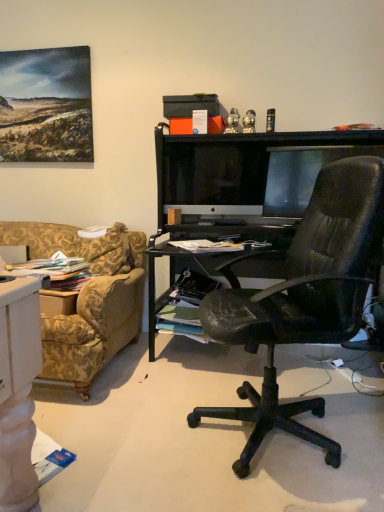
The width and height of the screenshot is (384, 512). Identify the location of matte black monitor at center, which is the 2th computer monitor from left to right. (296, 176).

Image resolution: width=384 pixels, height=512 pixels. Describe the element at coordinates (296, 176) in the screenshot. I see `matte black monitor at center, acting as the 1th computer monitor starting from the right` at that location.

Identify the location of satin black monitor at center, placed as the 1th computer monitor when sorted from left to right. This screenshot has width=384, height=512. (214, 175).

Describe the element at coordinates (214, 175) in the screenshot. The height and width of the screenshot is (512, 384). I see `satin black monitor at center, acting as the 2th computer monitor starting from the right` at that location.

Locate an element on the screen. The height and width of the screenshot is (512, 384). matte black monitor at center, acting as the 1th computer monitor starting from the right is located at coordinates (296, 176).

Is matte black monitor at center, which is the 2th computer monitor from left to right, at the left side of satin black monitor at center, acting as the 2th computer monitor starting from the right?

In fact, matte black monitor at center, which is the 2th computer monitor from left to right, is to the right of satin black monitor at center, acting as the 2th computer monitor starting from the right.

Is matte black monitor at center, which is the 2th computer monitor from left to right, in front of satin black monitor at center, acting as the 2th computer monitor starting from the right?

Yes, the depth of matte black monitor at center, which is the 2th computer monitor from left to right, is less than that of satin black monitor at center, acting as the 2th computer monitor starting from the right.

Considering the positions of points (302, 146) and (188, 192), is point (302, 146) closer to camera compared to point (188, 192)?

Yes, point (302, 146) is closer to viewer.

From the image's perspective, which one is positioned lower, matte black monitor at center, acting as the 1th computer monitor starting from the right, or satin black monitor at center, acting as the 2th computer monitor starting from the right?

matte black monitor at center, acting as the 1th computer monitor starting from the right, from the image's perspective.

From a real-world perspective, which is physically below, matte black monitor at center, which is the 2th computer monitor from left to right, or satin black monitor at center, acting as the 2th computer monitor starting from the right?

matte black monitor at center, which is the 2th computer monitor from left to right.

Which object is wider, matte black monitor at center, acting as the 1th computer monitor starting from the right, or satin black monitor at center, acting as the 2th computer monitor starting from the right?

Wider between the two is satin black monitor at center, acting as the 2th computer monitor starting from the right.

Considering the relative sizes of matte black monitor at center, which is the 2th computer monitor from left to right, and satin black monitor at center, placed as the 1th computer monitor when sorted from left to right, in the image provided, is matte black monitor at center, which is the 2th computer monitor from left to right, shorter than satin black monitor at center, placed as the 1th computer monitor when sorted from left to right,?

Indeed, matte black monitor at center, which is the 2th computer monitor from left to right, has a lesser height compared to satin black monitor at center, placed as the 1th computer monitor when sorted from left to right.

Which of these two, matte black monitor at center, acting as the 1th computer monitor starting from the right, or satin black monitor at center, placed as the 1th computer monitor when sorted from left to right, is bigger?

satin black monitor at center, placed as the 1th computer monitor when sorted from left to right, is bigger.

Is matte black monitor at center, acting as the 1th computer monitor starting from the right, completely or partially outside of satin black monitor at center, acting as the 2th computer monitor starting from the right?

matte black monitor at center, acting as the 1th computer monitor starting from the right, is positioned outside satin black monitor at center, acting as the 2th computer monitor starting from the right.

Consider the image. Is matte black monitor at center, acting as the 1th computer monitor starting from the right, not close to satin black monitor at center, placed as the 1th computer monitor when sorted from left to right?

No, matte black monitor at center, acting as the 1th computer monitor starting from the right, is not far from satin black monitor at center, placed as the 1th computer monitor when sorted from left to right.

Is matte black monitor at center, which is the 2th computer monitor from left to right, turned away from satin black monitor at center, acting as the 2th computer monitor starting from the right?

matte black monitor at center, which is the 2th computer monitor from left to right, does not have its back to satin black monitor at center, acting as the 2th computer monitor starting from the right.

How different are the orientations of matte black monitor at center, which is the 2th computer monitor from left to right, and satin black monitor at center, placed as the 1th computer monitor when sorted from left to right, in degrees?

matte black monitor at center, which is the 2th computer monitor from left to right, and satin black monitor at center, placed as the 1th computer monitor when sorted from left to right, are facing 34.7 degrees away from each other.

Measure the distance between matte black monitor at center, acting as the 1th computer monitor starting from the right, and satin black monitor at center, acting as the 2th computer monitor starting from the right.

10.64 inches.

Locate an element on the screen. computer monitor that is behind the matte black monitor at center, acting as the 1th computer monitor starting from the right is located at coordinates (214, 175).

Considering the relative positions of satin black monitor at center, placed as the 1th computer monitor when sorted from left to right, and matte black monitor at center, which is the 2th computer monitor from left to right, in the image provided, is satin black monitor at center, placed as the 1th computer monitor when sorted from left to right, to the left or to the right of matte black monitor at center, which is the 2th computer monitor from left to right,?

Clearly, satin black monitor at center, placed as the 1th computer monitor when sorted from left to right, is on the left of matte black monitor at center, which is the 2th computer monitor from left to right, in the image.

Is satin black monitor at center, acting as the 2th computer monitor starting from the right, positioned behind matte black monitor at center, which is the 2th computer monitor from left to right?

Yes, it is behind matte black monitor at center, which is the 2th computer monitor from left to right.

Does point (217, 179) come in front of point (297, 169)?

No, (217, 179) is behind (297, 169).

From the image's perspective, is satin black monitor at center, placed as the 1th computer monitor when sorted from left to right, positioned above or below matte black monitor at center, which is the 2th computer monitor from left to right?

satin black monitor at center, placed as the 1th computer monitor when sorted from left to right, is above matte black monitor at center, which is the 2th computer monitor from left to right.

From a real-world perspective, is satin black monitor at center, acting as the 2th computer monitor starting from the right, positioned over matte black monitor at center, which is the 2th computer monitor from left to right, based on gravity?

Yes, from a real-world perspective, satin black monitor at center, acting as the 2th computer monitor starting from the right, is on top of matte black monitor at center, which is the 2th computer monitor from left to right.

Is satin black monitor at center, placed as the 1th computer monitor when sorted from left to right, wider or thinner than matte black monitor at center, which is the 2th computer monitor from left to right?

In the image, satin black monitor at center, placed as the 1th computer monitor when sorted from left to right, appears to be wider than matte black monitor at center, which is the 2th computer monitor from left to right.

In terms of height, does satin black monitor at center, placed as the 1th computer monitor when sorted from left to right, look taller or shorter compared to matte black monitor at center, which is the 2th computer monitor from left to right?

satin black monitor at center, placed as the 1th computer monitor when sorted from left to right, is taller than matte black monitor at center, which is the 2th computer monitor from left to right.

Which of these two, satin black monitor at center, acting as the 2th computer monitor starting from the right, or matte black monitor at center, acting as the 1th computer monitor starting from the right, is bigger?

satin black monitor at center, acting as the 2th computer monitor starting from the right, is bigger.

Is satin black monitor at center, placed as the 1th computer monitor when sorted from left to right, spatially inside matte black monitor at center, which is the 2th computer monitor from left to right, or outside of it?

satin black monitor at center, placed as the 1th computer monitor when sorted from left to right, is not inside matte black monitor at center, which is the 2th computer monitor from left to right, it's outside.

Is satin black monitor at center, placed as the 1th computer monitor when sorted from left to right, next to matte black monitor at center, which is the 2th computer monitor from left to right?

They are not placed beside each other.

Is satin black monitor at center, acting as the 2th computer monitor starting from the right, looking in the opposite direction of matte black monitor at center, which is the 2th computer monitor from left to right?

No.

Can you tell me how much satin black monitor at center, placed as the 1th computer monitor when sorted from left to right, and matte black monitor at center, which is the 2th computer monitor from left to right, differ in facing direction?

satin black monitor at center, placed as the 1th computer monitor when sorted from left to right, and matte black monitor at center, which is the 2th computer monitor from left to right, are facing 34.7 degrees away from each other.

At what (x,y) coordinates should I click in order to perform the action: click on computer monitor above the matte black monitor at center, acting as the 1th computer monitor starting from the right (from the image's perspective). Please return your answer as a coordinate pair (x, y). This screenshot has width=384, height=512. Looking at the image, I should click on (214, 175).

The height and width of the screenshot is (512, 384). I want to click on computer monitor that is under the satin black monitor at center, placed as the 1th computer monitor when sorted from left to right (from a real-world perspective), so click(296, 176).

Locate an element on the screen. Image resolution: width=384 pixels, height=512 pixels. computer monitor in front of the satin black monitor at center, placed as the 1th computer monitor when sorted from left to right is located at coordinates pyautogui.click(x=296, y=176).